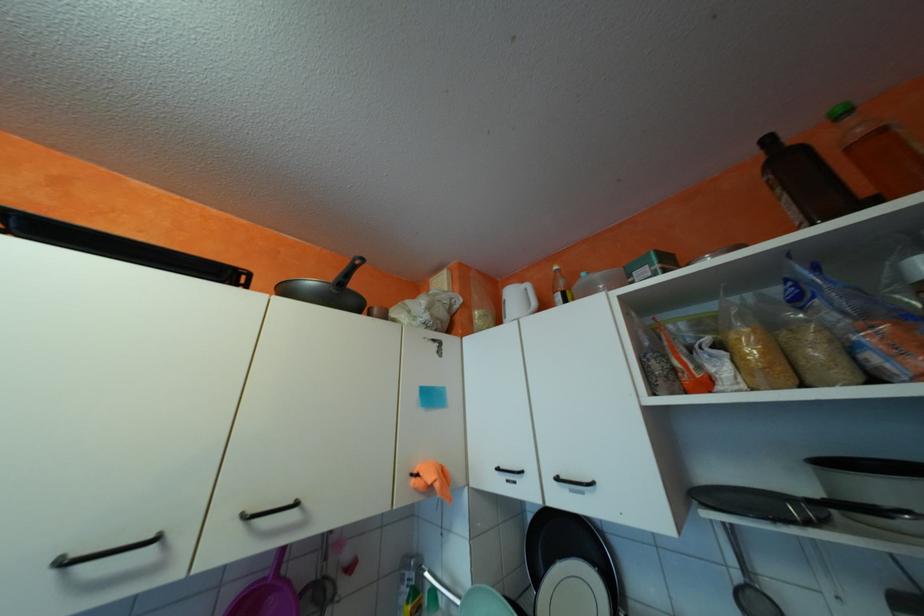
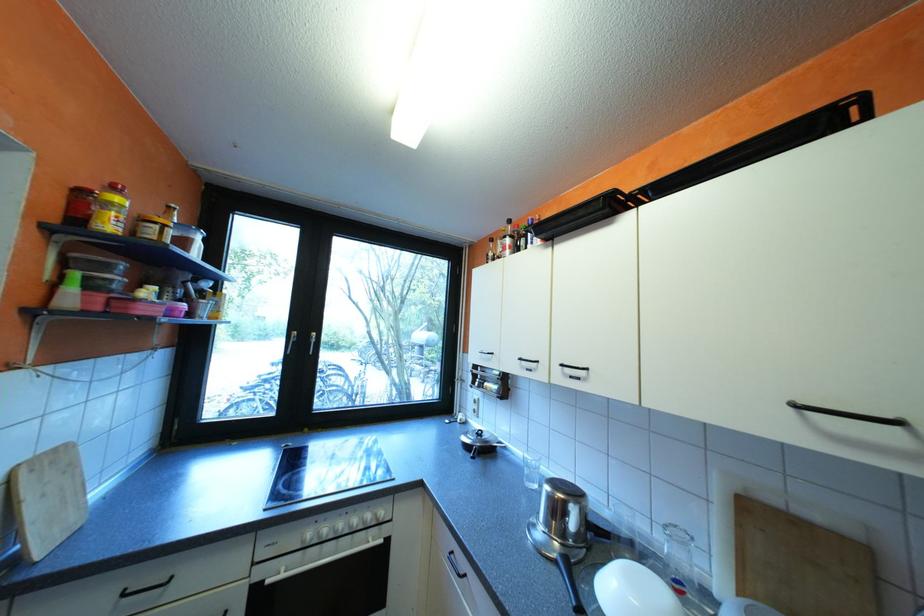
Question: Based on the continuous images, in which direction is the camera rotating? Reply with the corresponding letter.

Choices:
 (A) Left
 (B) Right
 (C) Up
 (D) Down

Answer: (A)